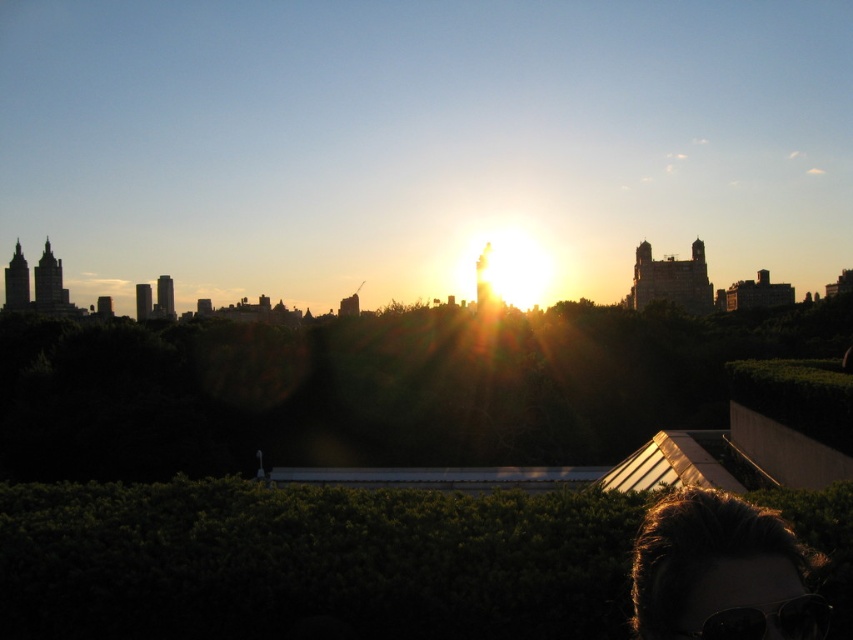
Based on the photo, you are a photographer capturing the sunset scene. You notice the dark brown hair at lower right and the black plastic goggles at lower right in your frame. Which object is taller in the image?

The dark brown hair at lower right is taller than the black plastic goggles at lower right according to the description.

You are a photographer capturing the sunset scene. You notice the dark brown hair at lower right and the black plastic goggles at lower right in your frame. Which object is positioned higher in the image?

The dark brown hair at lower right is located above the black plastic goggles at lower right, so it is positioned higher in the image.

You are a photographer trying to capture the sunset scene. You notice two items in the lower right corner of your frame. Which of the two items, the dark brown hair at lower right or the black plastic goggles at lower right, is larger in size?

The dark brown hair at lower right is bigger than the black plastic goggles at lower right, so the dark brown hair at lower right is larger in size.